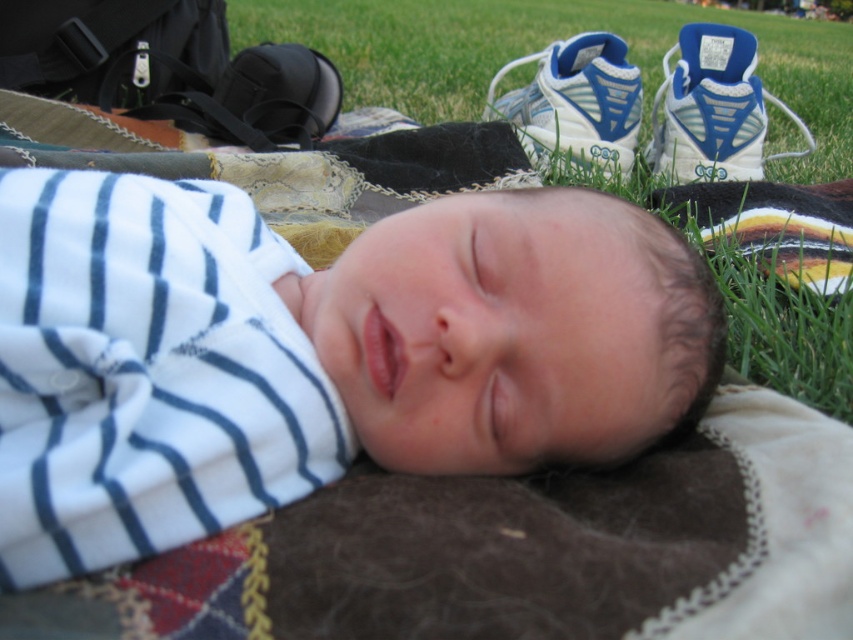
Looking at this image, who is more distant from viewer, (287, 244) or (624, 122)?

The point (624, 122) is behind.

Locate an element on the screen. white soft fabric newborn at center is located at coordinates (314, 353).

Who is more distant from viewer, (337,260) or (525,129)?

Point (525,129)

The image size is (853, 640). What are the coordinates of `white soft fabric newborn at center` in the screenshot? It's located at (314, 353).

Which is above, white synthetic running shoe at upper right or white mesh running shoe at upper center?

Positioned higher is white mesh running shoe at upper center.

Does white synthetic running shoe at upper right appear on the right side of white mesh running shoe at upper center?

Indeed, white synthetic running shoe at upper right is positioned on the right side of white mesh running shoe at upper center.

Which is in front, point (735, 83) or point (599, 154)?

Point (599, 154) is in front.

The width and height of the screenshot is (853, 640). What are the coordinates of `white synthetic running shoe at upper right` in the screenshot? It's located at (712, 108).

Find the location of a particular element. This screenshot has height=640, width=853. white soft fabric newborn at center is located at coordinates (314, 353).

Is white soft fabric newborn at center taller than white synthetic running shoe at upper right?

Incorrect, white soft fabric newborn at center's height is not larger of white synthetic running shoe at upper right's.

Where is `white soft fabric newborn at center`? white soft fabric newborn at center is located at coordinates [x=314, y=353].

The image size is (853, 640). Identify the location of white soft fabric newborn at center. (314, 353).